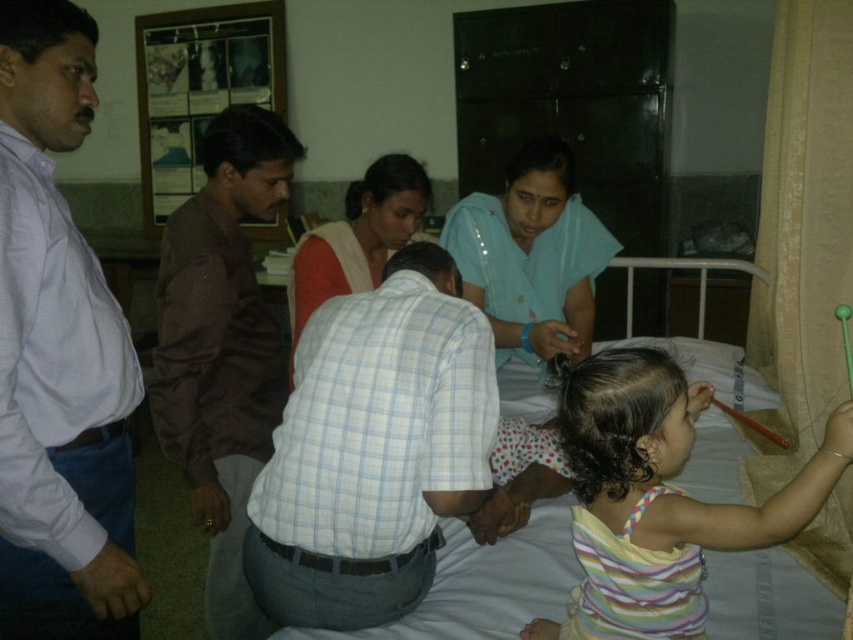
Question: Is white checkered shirt at center positioned before white fabric bed at center?

Choices:
 (A) yes
 (B) no

Answer: (A)

Question: Does white checkered shirt at center appear on the right side of white fabric bed at center?

Choices:
 (A) yes
 (B) no

Answer: (B)

Question: Which object is the closest to the light blue fabric at center?

Choices:
 (A) striped cotton shirt at lower right
 (B) white checkered shirt at center
 (C) white shirt at left
 (D) matte white shirt at center

Answer: (D)

Question: Which object is farther from the camera taking this photo?

Choices:
 (A) matte white shirt at center
 (B) white fabric bed at center
 (C) light blue fabric at center

Answer: (A)

Question: Which point is farther to the camera?

Choices:
 (A) white shirt at left
 (B) striped cotton shirt at lower right

Answer: (A)

Question: From the image, what is the correct spatial relationship of white checkered shirt at center in relation to white shirt at left?

Choices:
 (A) below
 (B) above

Answer: (A)